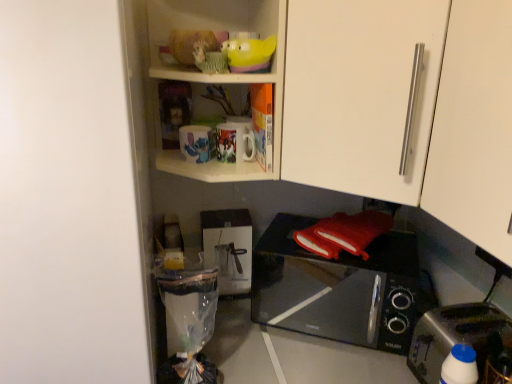
Where is `blank area beneath black glossy microwave oven at lower center (from a real-world perspective)`? blank area beneath black glossy microwave oven at lower center (from a real-world perspective) is located at coordinates (334, 307).